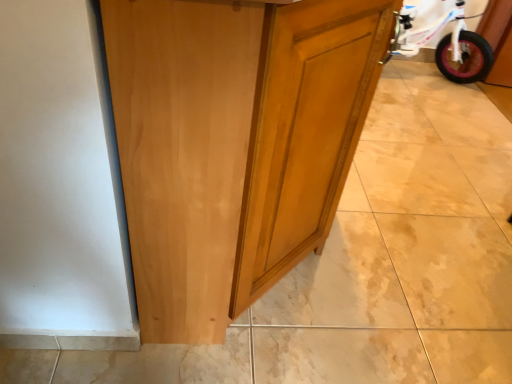
Where is `free location in front of pink rubber tire at right`? free location in front of pink rubber tire at right is located at coordinates point(445,121).